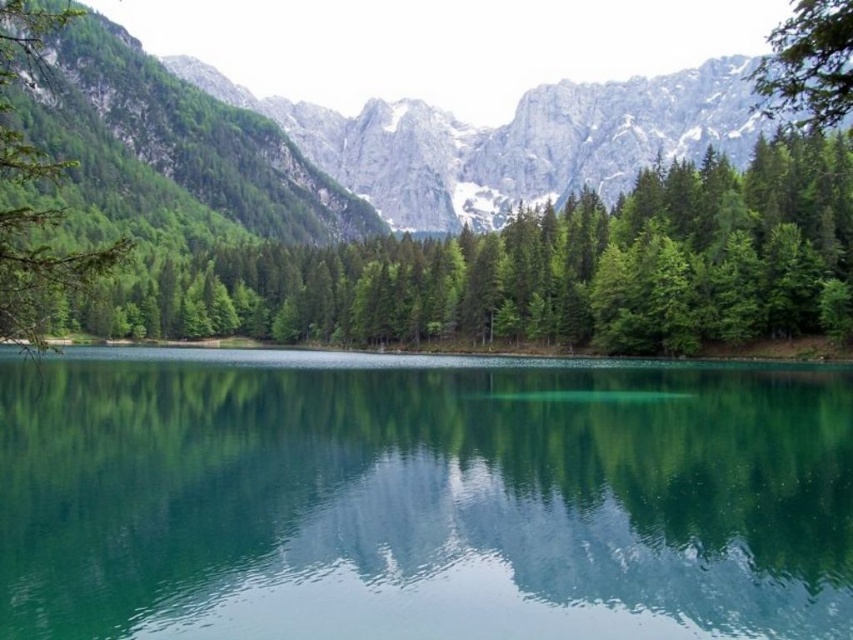
Question: Can you confirm if green matte tree at left is wider than green leafy tree at upper right?

Choices:
 (A) no
 (B) yes

Answer: (A)

Question: Which point is farther to the camera?

Choices:
 (A) green leafy tree at upper right
 (B) green matte tree at left
 (C) rocky gray mountain at upper center

Answer: (B)

Question: Which point is farther to the camera?

Choices:
 (A) (173, 173)
 (B) (74, 380)
 (C) (32, 262)
 (D) (772, 81)

Answer: (A)

Question: Can you confirm if green matte tree at upper center is positioned above green leafy tree at upper right?

Choices:
 (A) no
 (B) yes

Answer: (A)

Question: Among these objects, which one is farthest from the camera?

Choices:
 (A) green matte tree at left
 (B) green glassy water at center
 (C) rocky gray mountain at upper center
 (D) green leafy tree at upper right

Answer: (A)

Question: Does rocky gray mountain at upper center appear on the left side of green leafy tree at upper right?

Choices:
 (A) yes
 (B) no

Answer: (A)